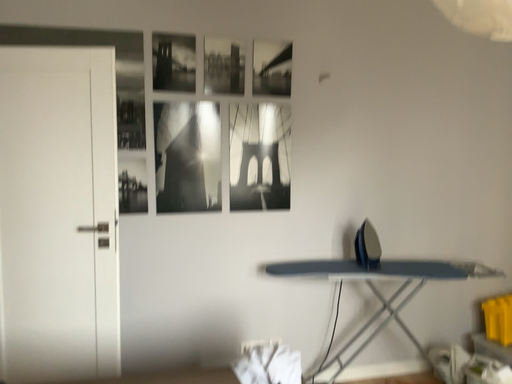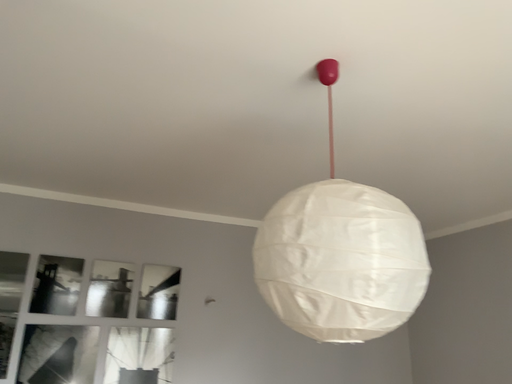
Question: Which way did the camera rotate in the video?

Choices:
 (A) rotated left
 (B) rotated right

Answer: (B)